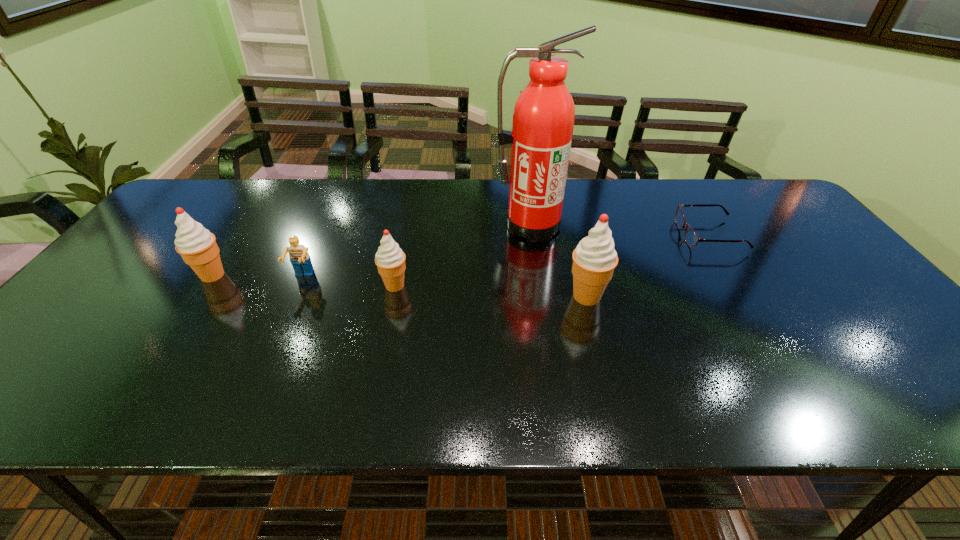
Where is `empty space between the shortest icecream and the shortest object`? The width and height of the screenshot is (960, 540). empty space between the shortest icecream and the shortest object is located at coordinates (552, 260).

Where is `vacant area that lies between the rightmost object and the tallest object`? This screenshot has height=540, width=960. vacant area that lies between the rightmost object and the tallest object is located at coordinates (620, 230).

Image resolution: width=960 pixels, height=540 pixels. What are the coordinates of `free space between the rightmost object and the leftmost icecream` in the screenshot? It's located at (462, 255).

The width and height of the screenshot is (960, 540). Identify the location of object that is the fourth closest to the leftmost icecream. (594, 259).

Identify which object is the fourth closest to the rightmost icecream. Please provide its 2D coordinates. Your answer should be formatted as a tuple, i.e. [(x, y)], where the tuple contains the x and y coordinates of a point satisfying the conditions above.

[(299, 257)]

Locate which icecream is the second closest to the leftmost object. Please provide its 2D coordinates. Your answer should be formatted as a tuple, i.e. [(x, y)], where the tuple contains the x and y coordinates of a point satisfying the conditions above.

[(594, 259)]

Select which icecream appears as the second closest to the leftmost icecream. Please provide its 2D coordinates. Your answer should be formatted as a tuple, i.e. [(x, y)], where the tuple contains the x and y coordinates of a point satisfying the conditions above.

[(594, 259)]

Identify the location of blank area in the image that satisfies the following two spatial constraints: 1. on the label side of the rightmost icecream; 2. on the right side of the tallest object. Image resolution: width=960 pixels, height=540 pixels. (540, 296).

Locate an element on the screen. Image resolution: width=960 pixels, height=540 pixels. vacant space that satisfies the following two spatial constraints: 1. on the label side of the rightmost icecream; 2. on the right side of the tallest object is located at coordinates (540, 296).

In order to click on vacant space that satisfies the following two spatial constraints: 1. on the front side of the rightmost icecream; 2. on the left side of the third shortest object in this screenshot , I will do `click(393, 296)`.